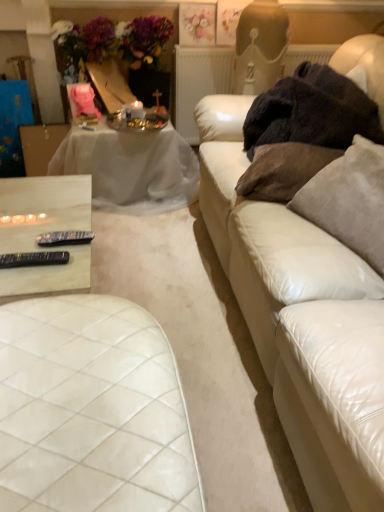
Question: Should I look upward or downward to see dark fuzzy blanket at right?

Choices:
 (A) down
 (B) up

Answer: (B)

Question: From the image's perspective, would you say white sheer cloth at upper left, marked as the 2th table in a front-to-back arrangement, is positioned over white leather couch at right?

Choices:
 (A) yes
 (B) no

Answer: (A)

Question: Is white sheer cloth at upper left, marked as the 2th table in a front-to-back arrangement, to the left of white leather couch at right from the viewer's perspective?

Choices:
 (A) yes
 (B) no

Answer: (A)

Question: Considering the relative sizes of white sheer cloth at upper left, which is the first table in top-to-bottom order, and white leather couch at right in the image provided, is white sheer cloth at upper left, which is the first table in top-to-bottom order, shorter than white leather couch at right?

Choices:
 (A) no
 (B) yes

Answer: (B)

Question: From a real-world perspective, is white sheer cloth at upper left, which is the first table in top-to-bottom order, physically below white leather couch at right?

Choices:
 (A) no
 (B) yes

Answer: (B)

Question: Could you tell me if white sheer cloth at upper left, marked as the 2th table in a front-to-back arrangement, is turned towards white leather couch at right?

Choices:
 (A) yes
 (B) no

Answer: (A)

Question: Can you confirm if white sheer cloth at upper left, positioned as the first table in back-to-front order, is bigger than white leather couch at right?

Choices:
 (A) no
 (B) yes

Answer: (A)

Question: Considering the relative sizes of white leather couch at right and suede-like beige pillow at right, which is the first pillow in right-to-left order, in the image provided, is white leather couch at right taller than suede-like beige pillow at right, which is the first pillow in right-to-left order,?

Choices:
 (A) no
 (B) yes

Answer: (B)

Question: Does white leather couch at right have a greater width compared to suede-like beige pillow at right, which is the first pillow in right-to-left order?

Choices:
 (A) no
 (B) yes

Answer: (B)

Question: From a real-world perspective, is white leather couch at right beneath suede-like beige pillow at right, which is the first pillow in right-to-left order?

Choices:
 (A) yes
 (B) no

Answer: (A)

Question: Does white leather couch at right have a lesser width compared to suede-like beige pillow at right, which is the first pillow in right-to-left order?

Choices:
 (A) no
 (B) yes

Answer: (A)

Question: From the image's perspective, would you say white leather couch at right is positioned over suede-like beige pillow at right, which is counted as the second pillow, starting from the left?

Choices:
 (A) yes
 (B) no

Answer: (B)

Question: Is white leather couch at right shorter than suede-like beige pillow at right, which is counted as the second pillow, starting from the left?

Choices:
 (A) no
 (B) yes

Answer: (A)

Question: Can you confirm if pastel floral print at upper center is smaller than white quilted leather ottoman at lower left?

Choices:
 (A) yes
 (B) no

Answer: (A)